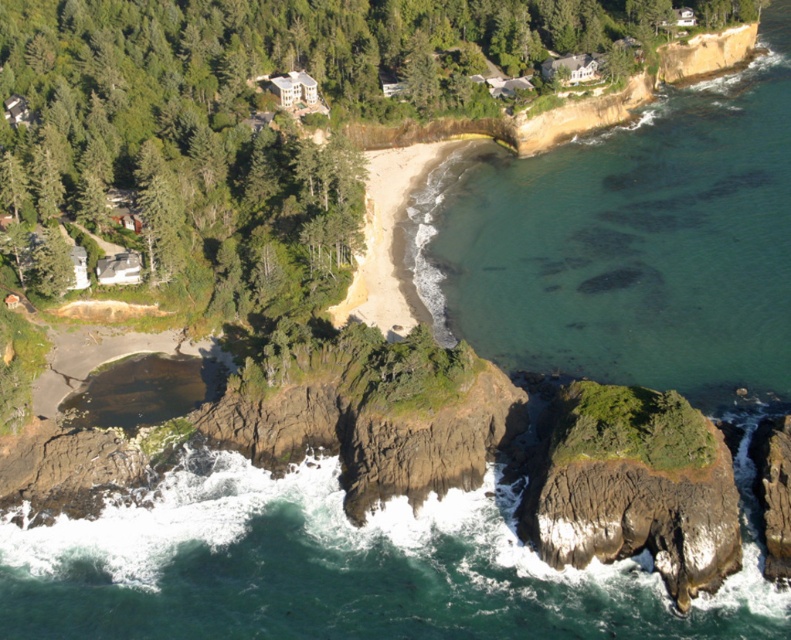
You are a drone operator flying over the coastal landscape. Your drone is currently above the clear water at upper right and needs to descend to the rugged brown rock at lower right. Can the drone safely descend vertically without hitting any obstacles?

The clear water at upper right is further to the viewer than the rugged brown rock at lower right, meaning the rock is closer to the drone. Therefore, descending vertically might bring the drone too close to the rugged brown rock at lower right, posing a collision risk. The drone should adjust its path to avoid the rock.

You are a drone operator flying over the coastal landscape. You need to determine if the clear water at upper right is taller than the rugged brown rock at lower right based on the aerial view. Can you confirm this?

The clear water at upper right is much taller than the rugged brown rock at lower right according to the description, so yes, the clear water at upper right is taller.

You are a drone operator tasked with capturing aerial footage of the coastal landscape. Your drone has a maximum flight range of 40 meters from its starting position. If you position the drone above the rugged brown rock at lower right, will it be able to capture the clear water at upper right without exceeding its range?

The distance between the clear water at upper right and rugged brown rock at lower right is 37.88 meters, which is within the drone operator s 40 meter range. Therefore, the drone can capture the clear water at upper right without exceeding its maximum flight range.